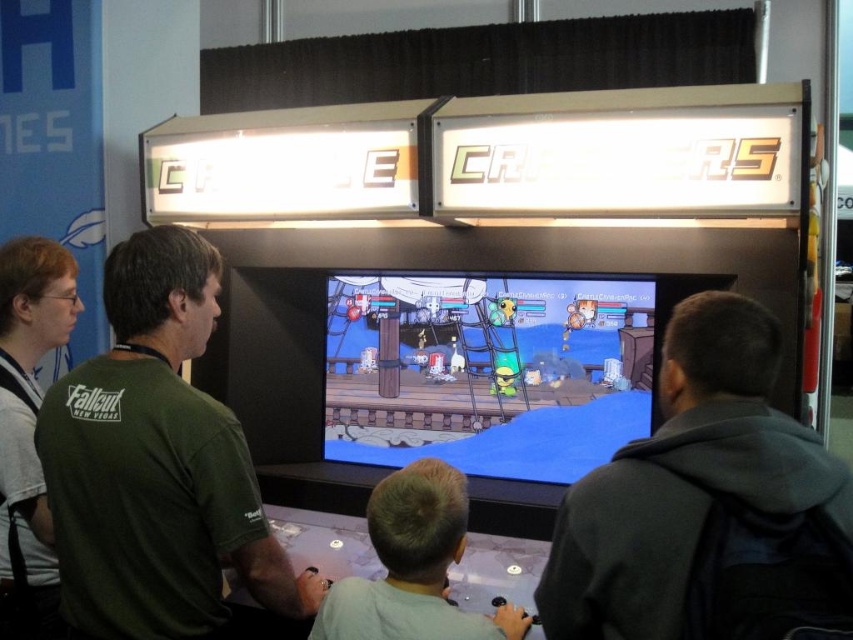
Question: Based on their relative distances, which object is nearer to the dark gray hoodie at right?

Choices:
 (A) green matte shirt at left
 (B) light brown hair at center

Answer: (B)

Question: Does dark gray hoodie at right have a smaller size compared to light brown hair at center?

Choices:
 (A) no
 (B) yes

Answer: (A)

Question: Is dark gray hoodie at right in front of green matte shirt at left?

Choices:
 (A) no
 (B) yes

Answer: (B)

Question: Based on their relative distances, which object is farther from the dark gray hoodie at right?

Choices:
 (A) green matte shirt at left
 (B) light brown hair at center

Answer: (A)

Question: Does green matte shirt at left appear under light brown hair at center?

Choices:
 (A) no
 (B) yes

Answer: (A)

Question: Which point appears farthest from the camera in this image?

Choices:
 (A) (622, 509)
 (B) (524, 618)

Answer: (B)